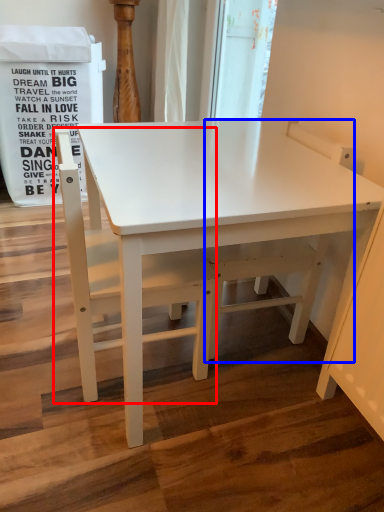
Question: Which object is closer to the camera taking this photo, chair (highlighted by a red box) or swivel chair (highlighted by a blue box)?

Choices:
 (A) chair
 (B) swivel chair

Answer: (A)